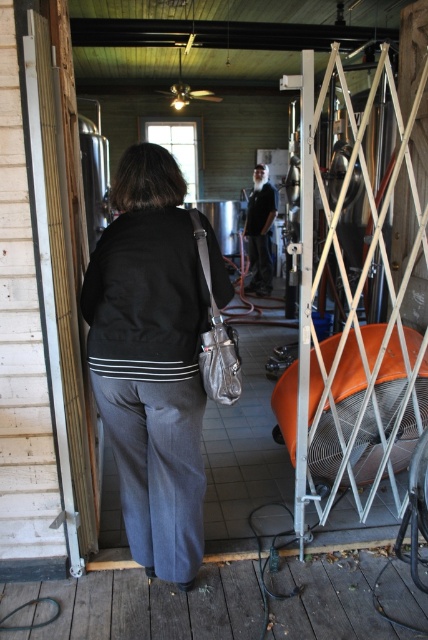
In the scene shown: Which is more to the left, wooden screen door at left or black leather jacket at center?

wooden screen door at left is more to the left.

Which of these two, wooden screen door at left or black leather jacket at center, stands taller?

With more height is wooden screen door at left.

Is point (62, 304) less distant than point (270, 275)?

Yes, it is.

Find the location of a particular element. The height and width of the screenshot is (640, 428). wooden screen door at left is located at coordinates (59, 289).

Who is taller, matte black jacket at center or wooden screen door at left?

wooden screen door at left

Is matte black jacket at center below wooden screen door at left?

Correct, matte black jacket at center is located below wooden screen door at left.

Where is `matte black jacket at center`? The image size is (428, 640). matte black jacket at center is located at coordinates (151, 360).

What are the coordinates of `matte black jacket at center` in the screenshot? It's located at (151, 360).

Can you confirm if matte black jacket at center is positioned below black leather jacket at center?

→ Yes, matte black jacket at center is below black leather jacket at center.

Is matte black jacket at center behind black leather jacket at center?

No, it is not.

The width and height of the screenshot is (428, 640). In order to click on matte black jacket at center in this screenshot , I will do `click(151, 360)`.